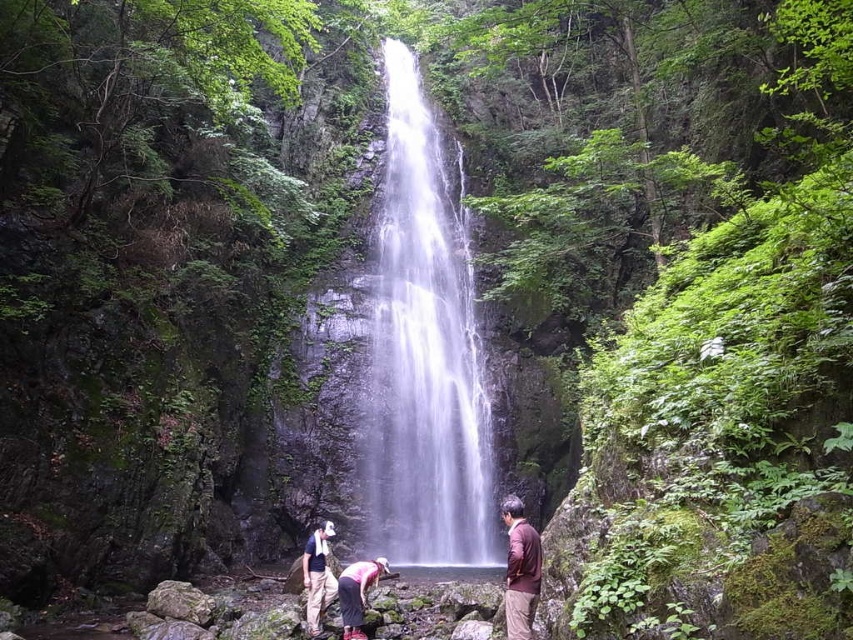
You are a photographer trying to capture a photo of the clear glass waterfall at center and the brown matte shirt at center. Which object should you focus on first if you want to ensure both are in the frame without moving the camera?

The clear glass waterfall at center is wider than the brown matte shirt at center, so you should focus on the clear glass waterfall at center first to ensure its entire width fits in the frame before adjusting for the smaller brown matte shirt at center.

You are a photographer trying to capture the waterfall and the tourists in the foreground. Since the clear glass waterfall at center is larger than the pink fabric pants at lower center, which object should you focus on to ensure both are visible in the frame?

The clear glass waterfall at center is bigger than the pink fabric pants at lower center, so focusing on the waterfall will ensure both are visible as the waterfall takes up more space in the frame.